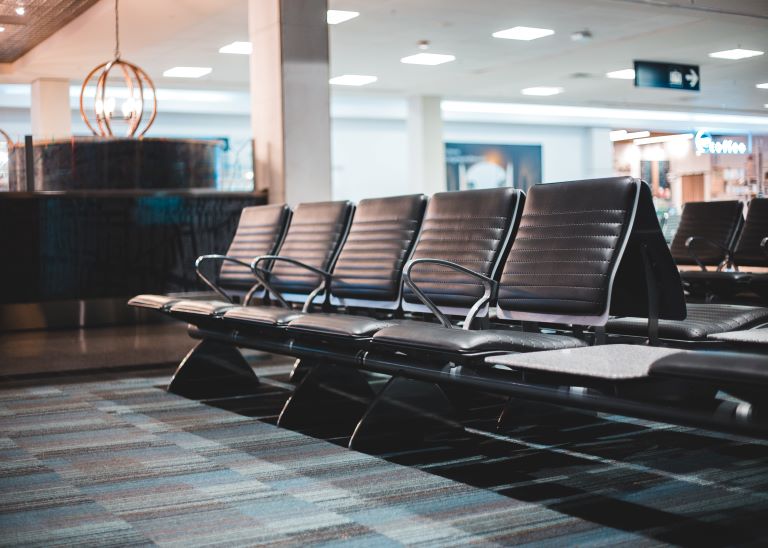
Where is `pillar`? The height and width of the screenshot is (548, 768). pillar is located at coordinates (303, 79).